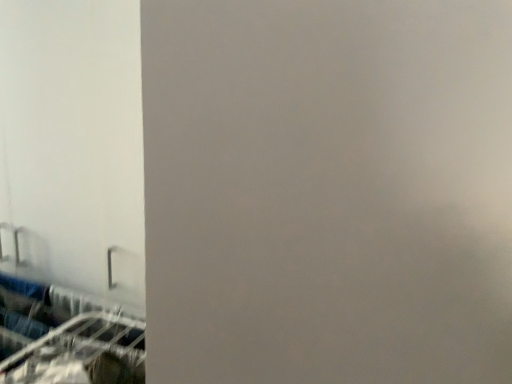
Locate an element on the screen. metallic silver sink at lower left is located at coordinates (66, 337).

Measure the distance between metallic silver sink at lower left and camera.

They are 36.48 inches apart.

Describe the element at coordinates (66, 337) in the screenshot. I see `metallic silver sink at lower left` at that location.

This screenshot has height=384, width=512. What are the coordinates of `metallic silver sink at lower left` in the screenshot? It's located at (66, 337).